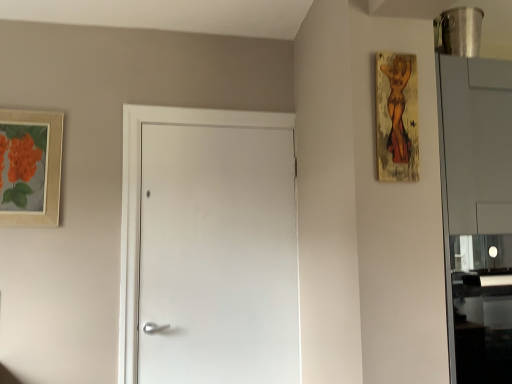
Question: Can you confirm if white matte door at center is positioned to the right of wooden textured painting at upper right, marked as the 2th picture frame in a back-to-front arrangement?

Choices:
 (A) no
 (B) yes

Answer: (A)

Question: Is white matte door at center aimed at wooden textured painting at upper right, which is counted as the first picture frame, starting from the front?

Choices:
 (A) yes
 (B) no

Answer: (A)

Question: From the image's perspective, is white matte door at center beneath wooden textured painting at upper right, the 2th picture frame viewed from the left?

Choices:
 (A) no
 (B) yes

Answer: (B)

Question: Considering the relative sizes of white matte door at center and wooden textured painting at upper right, marked as the 2th picture frame in a back-to-front arrangement, in the image provided, is white matte door at center thinner than wooden textured painting at upper right, marked as the 2th picture frame in a back-to-front arrangement,?

Choices:
 (A) yes
 (B) no

Answer: (B)

Question: Can you confirm if white matte door at center is positioned to the left of wooden textured painting at upper right, which is counted as the first picture frame, starting from the front?

Choices:
 (A) no
 (B) yes

Answer: (B)

Question: Would you say wooden textured painting at upper right, the 2th picture frame viewed from the left, is inside or outside white matte door at center?

Choices:
 (A) outside
 (B) inside

Answer: (A)

Question: From a real-world perspective, is wooden textured painting at upper right, the 2th picture frame viewed from the left, above or below white matte door at center?

Choices:
 (A) above
 (B) below

Answer: (A)

Question: In the image, is wooden textured painting at upper right, which is counted as the first picture frame, starting from the front, on the left side or the right side of white matte door at center?

Choices:
 (A) left
 (B) right

Answer: (B)

Question: Is point (392, 153) closer or farther from the camera than point (295, 360)?

Choices:
 (A) closer
 (B) farther

Answer: (A)

Question: Considering the positions of point (381, 157) and point (27, 178), is point (381, 157) closer or farther from the camera than point (27, 178)?

Choices:
 (A) farther
 (B) closer

Answer: (B)

Question: Considering the positions of wooden textured painting at upper right, marked as the 2th picture frame in a back-to-front arrangement, and matte wooden picture frame at upper left, the second picture frame when ordered from front to back, in the image, is wooden textured painting at upper right, marked as the 2th picture frame in a back-to-front arrangement, taller or shorter than matte wooden picture frame at upper left, the second picture frame when ordered from front to back,?

Choices:
 (A) tall
 (B) short

Answer: (B)

Question: Is wooden textured painting at upper right, marked as the first picture frame in a right-to-left arrangement, to the left or to the right of matte wooden picture frame at upper left, acting as the second picture frame starting from the right, in the image?

Choices:
 (A) left
 (B) right

Answer: (B)

Question: In terms of width, does wooden textured painting at upper right, marked as the first picture frame in a right-to-left arrangement, look wider or thinner when compared to matte wooden picture frame at upper left, which is the first picture frame from left to right?

Choices:
 (A) thin
 (B) wide

Answer: (B)

Question: Looking at the image, does matte wooden picture frame at upper left, acting as the second picture frame starting from the right, seem bigger or smaller compared to wooden textured painting at upper right, marked as the first picture frame in a right-to-left arrangement?

Choices:
 (A) big
 (B) small

Answer: (A)

Question: Is matte wooden picture frame at upper left, the first picture frame positioned from the back, in front of or behind wooden textured painting at upper right, marked as the 2th picture frame in a back-to-front arrangement, in the image?

Choices:
 (A) behind
 (B) front

Answer: (A)